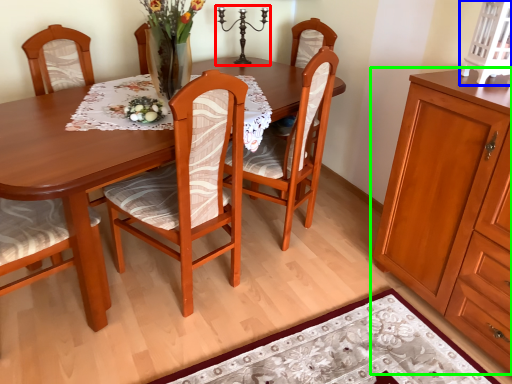
Question: Which is farther away from candle holder (highlighted by a red box)? cabinetry (highlighted by a blue box) or cabinetry (highlighted by a green box)?

Choices:
 (A) cabinetry
 (B) cabinetry

Answer: (B)